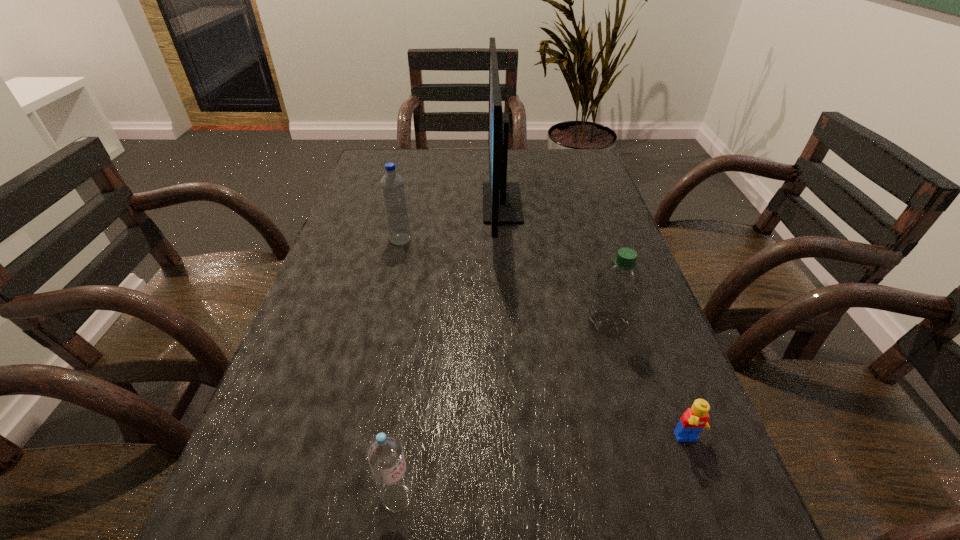
Where is `vacant space that satisfies the following two spatial constraints: 1. on the screen side of the computer monitor; 2. on the front side of the leftmost water bottle`? This screenshot has height=540, width=960. vacant space that satisfies the following two spatial constraints: 1. on the screen side of the computer monitor; 2. on the front side of the leftmost water bottle is located at coordinates (505, 240).

In order to click on vacant space that satisfies the following two spatial constraints: 1. on the screen side of the computer monitor; 2. on the front side of the nearest object in this screenshot , I will do `click(523, 497)`.